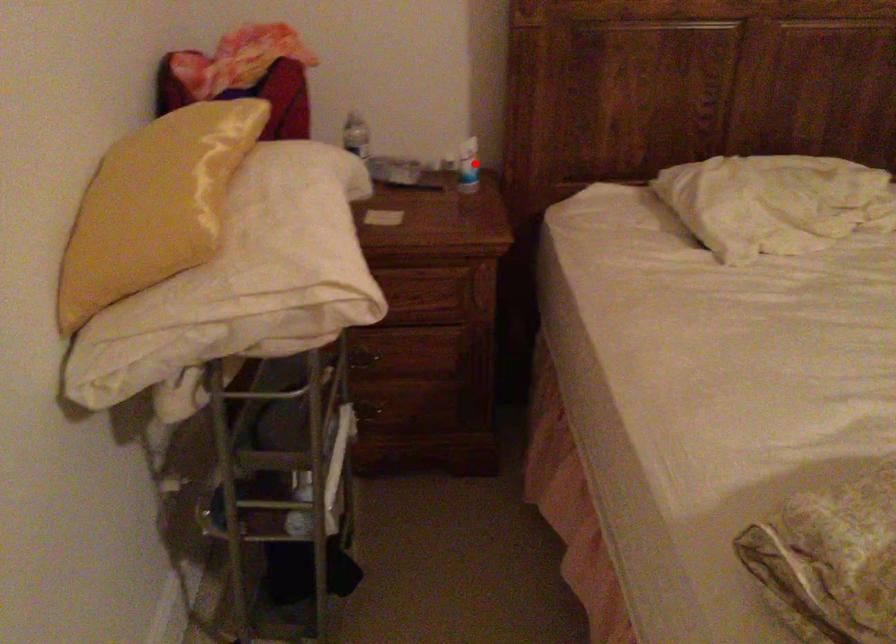
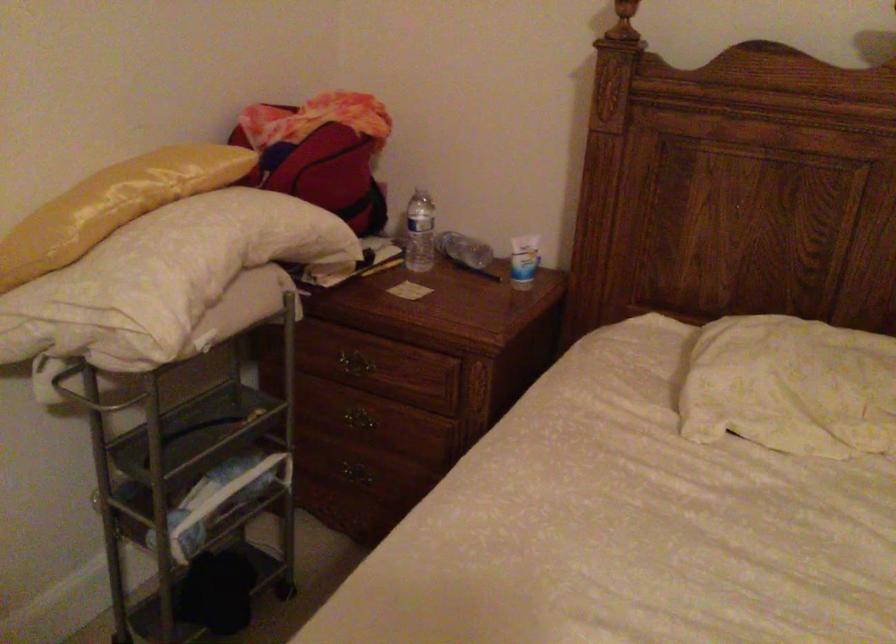
The point at the highlighted location is marked in the first image. Where is the corresponding point in the second image?

(523, 261)